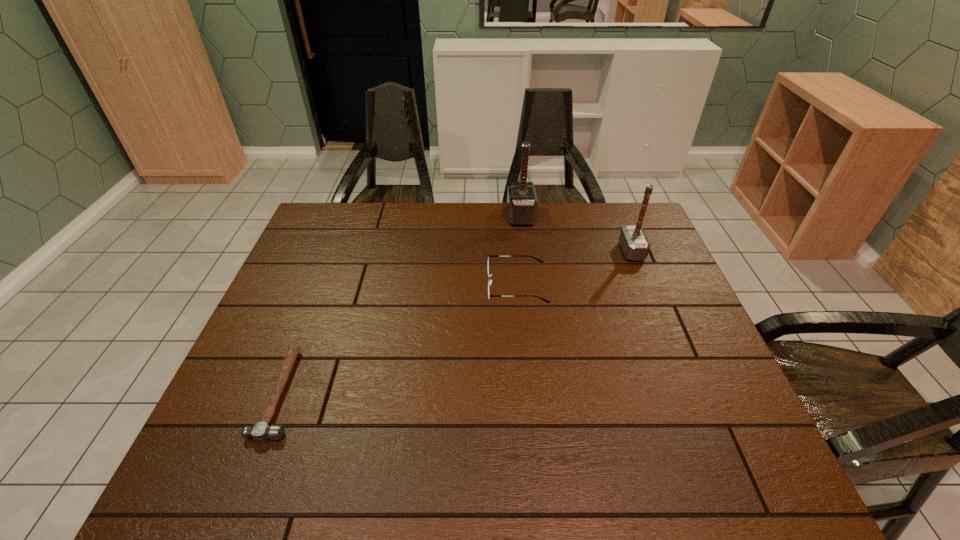
I want to click on vacant point located between the farthest hammer and the spectacles, so click(519, 251).

This screenshot has width=960, height=540. I want to click on vacant space that's between the third nearest object and the second hammer from left to right, so click(x=576, y=233).

Locate an element on the screen. Image resolution: width=960 pixels, height=540 pixels. blank region between the leftmost object and the third nearest object is located at coordinates (456, 322).

The width and height of the screenshot is (960, 540). In order to click on vacant point located between the spectacles and the second nearest hammer in this screenshot , I will do point(574,268).

Choose which object is the nearest neighbor to the rightmost object. Please provide its 2D coordinates. Your answer should be formatted as a tuple, i.e. [(x, y)], where the tuple contains the x and y coordinates of a point satisfying the conditions above.

[(490, 281)]

Find the location of a particular element. The height and width of the screenshot is (540, 960). object that ranks as the third closest to the shortest hammer is located at coordinates (634, 243).

The image size is (960, 540). Identify the location of the second closest hammer to the farthest hammer. (261, 431).

I want to click on hammer identified as the closest to the rightmost hammer, so click(522, 203).

This screenshot has width=960, height=540. In order to click on free space that satisfies the following two spatial constraints: 1. on the front side of the farthest object; 2. on the striking face of the leftmost hammer in this screenshot , I will do `click(542, 393)`.